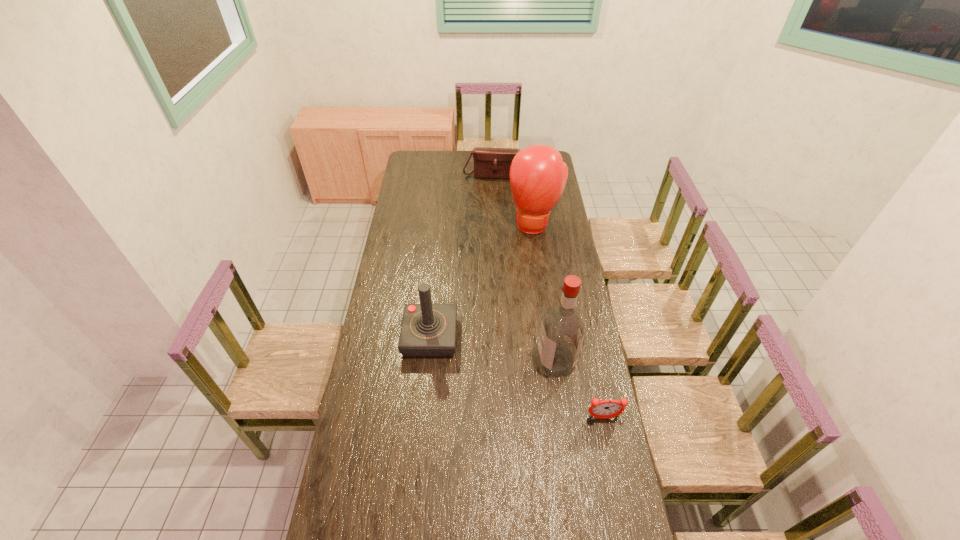
Image resolution: width=960 pixels, height=540 pixels. I want to click on vacant space that's between the third shortest object and the nearest object, so click(x=516, y=377).

The height and width of the screenshot is (540, 960). Identify the location of empty space that is in between the liquor and the fourth nearest object. (545, 293).

What are the coordinates of `empty space that is in between the shoulder bag and the joystick` in the screenshot? It's located at (463, 255).

Identify the location of free point between the alarm clock and the third shortest object. The height and width of the screenshot is (540, 960). (516, 377).

This screenshot has height=540, width=960. Find the location of `unoccupied position between the liquor and the second farthest object`. unoccupied position between the liquor and the second farthest object is located at coordinates (545, 293).

The image size is (960, 540). Find the location of `free space between the alarm clock and the liquor`. free space between the alarm clock and the liquor is located at coordinates (580, 389).

Identify the location of object that is the third closest to the shoulder bag. The width and height of the screenshot is (960, 540). (562, 331).

Image resolution: width=960 pixels, height=540 pixels. Find the location of `object identified as the closest to the shoulder bag`. object identified as the closest to the shoulder bag is located at coordinates (538, 175).

Locate an element on the screen. vacant space that satisfies the following two spatial constraints: 1. on the rectangular base of the liquor; 2. on the right side of the joystick is located at coordinates (x=428, y=361).

Where is `vacant space that satisfies the following two spatial constraints: 1. on the front side of the liquor; 2. on the left side of the second farthest object`? vacant space that satisfies the following two spatial constraints: 1. on the front side of the liquor; 2. on the left side of the second farthest object is located at coordinates (553, 361).